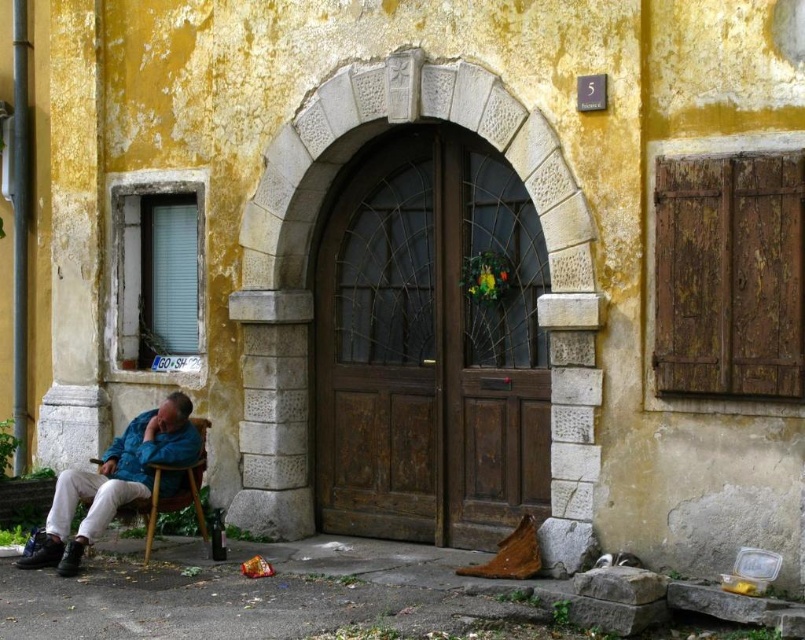
Who is more distant from viewer, (71,509) or (159,483)?

The point (71,509) is more distant.

Who is higher up, blue denim jacket at lower left or wooden at left?

blue denim jacket at lower left is above.

This screenshot has height=640, width=805. Describe the element at coordinates (114, 481) in the screenshot. I see `blue denim jacket at lower left` at that location.

I want to click on blue denim jacket at lower left, so click(114, 481).

Which is more to the right, brown wooden door at center or blue denim jacket at lower left?

From the viewer's perspective, brown wooden door at center appears more on the right side.

Between point (477, 163) and point (147, 426), which one is positioned in front?

Positioned in front is point (477, 163).

Measure the distance between brown wooden door at center and camera.

A distance of 7.74 meters exists between brown wooden door at center and camera.

I want to click on brown wooden door at center, so click(x=428, y=348).

Which of these two, brown wooden door at center or wooden door at center, stands shorter?

wooden door at center

Does point (434, 417) come farther from viewer compared to point (464, 534)?

Yes, point (434, 417) is behind point (464, 534).

The height and width of the screenshot is (640, 805). Identify the location of brown wooden door at center. (428, 348).

Where is `brown wooden door at center`? This screenshot has height=640, width=805. brown wooden door at center is located at coordinates (428, 348).